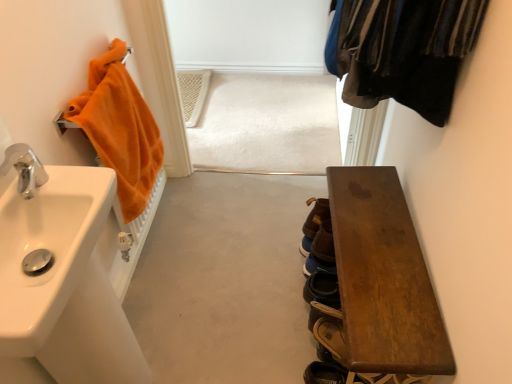
Identify the location of vacant space to the right of silver metallic faucet at left. Image resolution: width=512 pixels, height=384 pixels. (x=77, y=179).